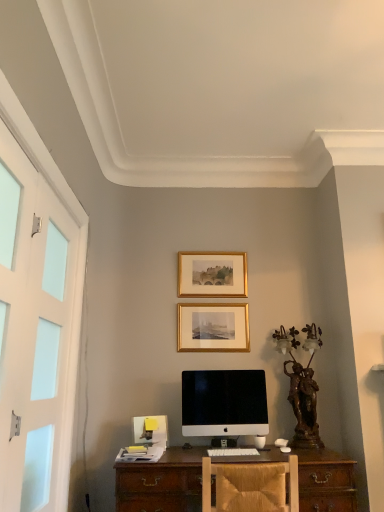
Question: Which direction should I rotate to face gold/gilded picture frame at upper center, the 1th picture frame positioned from the top, — up or down?

Choices:
 (A) up
 (B) down

Answer: (B)

Question: Does white matte screen door at left have a greater height compared to wooden chair at center?

Choices:
 (A) no
 (B) yes

Answer: (B)

Question: Considering the relative sizes of white matte screen door at left and wooden chair at center in the image provided, is white matte screen door at left shorter than wooden chair at center?

Choices:
 (A) no
 (B) yes

Answer: (A)

Question: From the image's perspective, is white matte screen door at left beneath wooden chair at center?

Choices:
 (A) yes
 (B) no

Answer: (B)

Question: Does white matte screen door at left contain wooden chair at center?

Choices:
 (A) no
 (B) yes

Answer: (A)

Question: Considering the relative positions of white matte screen door at left and wooden chair at center in the image provided, is white matte screen door at left in front of wooden chair at center?

Choices:
 (A) yes
 (B) no

Answer: (A)

Question: Is white matte screen door at left smaller than wooden chair at center?

Choices:
 (A) yes
 (B) no

Answer: (A)

Question: From the image's perspective, is wooden chair at center under white matte screen door at left?

Choices:
 (A) yes
 (B) no

Answer: (A)

Question: Is wooden chair at center facing away from white matte screen door at left?

Choices:
 (A) yes
 (B) no

Answer: (B)

Question: Is the position of wooden chair at center less distant than that of white matte screen door at left?

Choices:
 (A) no
 (B) yes

Answer: (A)

Question: From the image's perspective, does wooden chair at center appear higher than white matte screen door at left?

Choices:
 (A) yes
 (B) no

Answer: (B)

Question: Would you say wooden chair at center is outside white matte screen door at left?

Choices:
 (A) no
 (B) yes

Answer: (B)

Question: From a real-world perspective, is wooden chair at center over white matte screen door at left?

Choices:
 (A) yes
 (B) no

Answer: (B)

Question: Is white matte screen door at left at the left side of gold metallic picture frame at center, positioned as the 1th picture frame in bottom-to-top order?

Choices:
 (A) no
 (B) yes

Answer: (B)